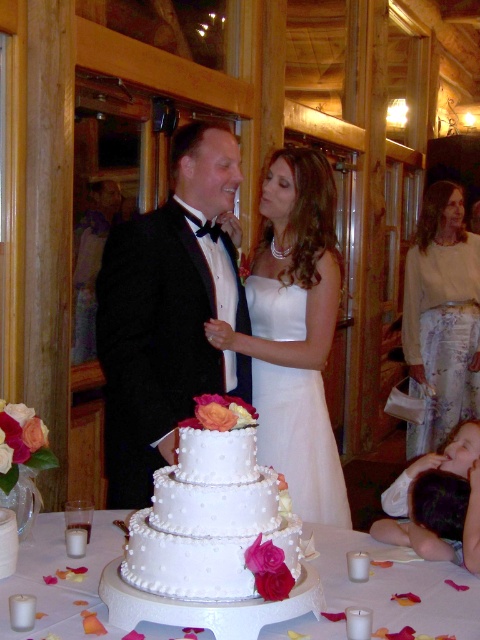
Between black satin tuxedo at center and white pearl cake at center, which one has less height?

Standing shorter between the two is white pearl cake at center.

Does black satin tuxedo at center have a larger size compared to white pearl cake at center?

Yes.

Measure the distance between black satin tuxedo at center and camera.

They are 5.72 feet apart.

Locate an element on the screen. black satin tuxedo at center is located at coordinates (168, 312).

Measure the distance from white floral pants at right to white satin wedding dress at center.

A distance of 1.91 meters exists between white floral pants at right and white satin wedding dress at center.

Which of these two, white floral pants at right or white satin wedding dress at center, stands taller?

white floral pants at right is taller.

Describe the element at coordinates (442, 317) in the screenshot. I see `white floral pants at right` at that location.

Where is `white floral pants at right`? The image size is (480, 640). white floral pants at right is located at coordinates (442, 317).

Does white textured cake at center lie in front of white floral pants at right?

That is True.

What do you see at coordinates (215, 515) in the screenshot?
I see `white textured cake at center` at bounding box center [215, 515].

Find the location of a particular element. white textured cake at center is located at coordinates (215, 515).

Locate an element on the screen. The height and width of the screenshot is (640, 480). white textured cake at center is located at coordinates (215, 515).